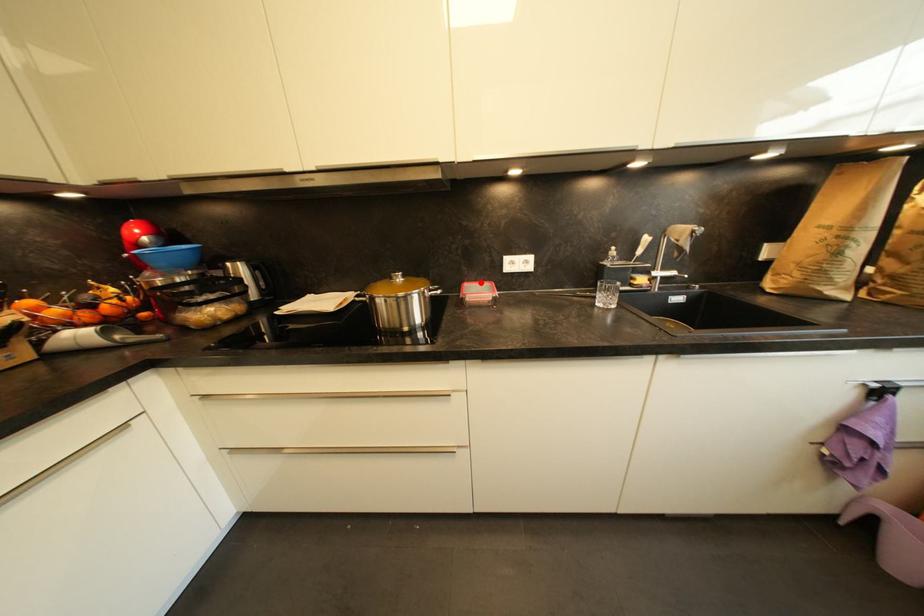
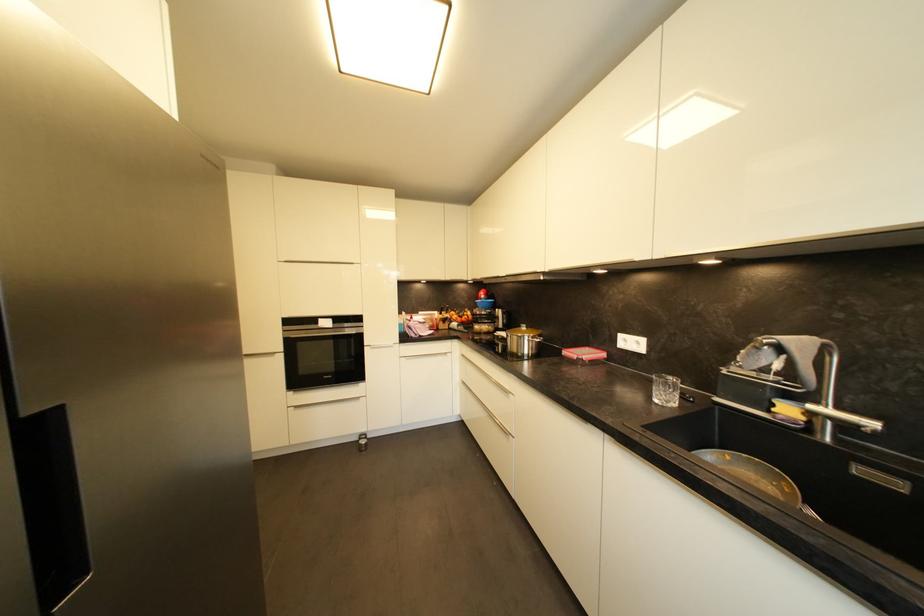
Where in the second image is the point corresponding to the highlighted location from the first image?

(602, 350)